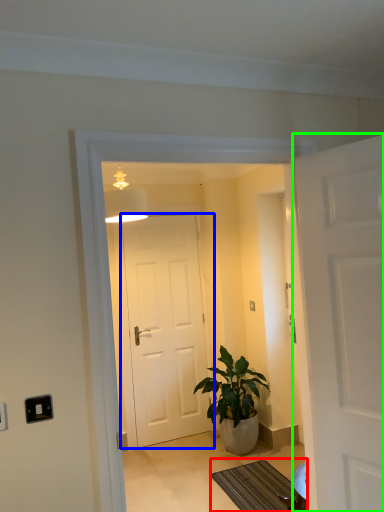
Question: Which object is positioned closest to doormat (highlighted by a red box)? Select from door (highlighted by a blue box) and door (highlighted by a green box).

Choices:
 (A) door
 (B) door

Answer: (A)